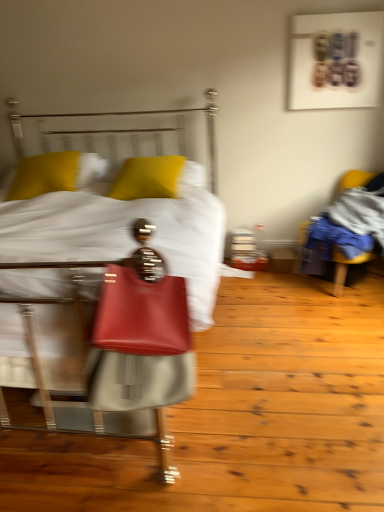
Describe the element at coordinates (140, 334) in the screenshot. I see `matte red handbag at center` at that location.

From the picture: What is the approximate width of yellow fabric chair at right?

It is 27.40 inches.

What do you see at coordinates (147, 178) in the screenshot?
I see `yellow matte pillow at center, the first pillow positioned from the right` at bounding box center [147, 178].

What do you see at coordinates (55, 173) in the screenshot? I see `yellow matte pillow at upper left, which appears as the 2th pillow when viewed from the right` at bounding box center [55, 173].

Locate an element on the screen. The height and width of the screenshot is (512, 384). matte red handbag at center is located at coordinates tap(140, 334).

Considering the relative sizes of yellow fabric chair at right and matte red handbag at center in the image provided, is yellow fabric chair at right shorter than matte red handbag at center?

No.

Is point (355, 258) closer to camera compared to point (106, 300)?

No, it is not.

Where is `person positioned vertically above the yellow fabric chair at right (from a real-world perspective)`? person positioned vertically above the yellow fabric chair at right (from a real-world perspective) is located at coordinates (140, 334).

Considering the sizes of objects yellow fabric chair at right and matte red handbag at center in the image provided, who is wider, yellow fabric chair at right or matte red handbag at center?

Wider between the two is yellow fabric chair at right.

Is yellow matte pillow at upper left, which appears as the 2th pillow when viewed from the right, aimed at yellow matte pillow at center, the first pillow positioned from the right?

No, yellow matte pillow at upper left, which appears as the 2th pillow when viewed from the right, does not turn towards yellow matte pillow at center, the first pillow positioned from the right.

Which object is closer to the camera, yellow matte pillow at upper left, which appears as the 2th pillow when viewed from the right, or yellow matte pillow at center, the second pillow in the left-to-right sequence?

Positioned in front is yellow matte pillow at center, the second pillow in the left-to-right sequence.

In the scene shown: Considering the sizes of yellow matte pillow at upper left, which appears as the 2th pillow when viewed from the right, and yellow matte pillow at center, the second pillow in the left-to-right sequence, in the image, is yellow matte pillow at upper left, which appears as the 2th pillow when viewed from the right, wider or thinner than yellow matte pillow at center, the second pillow in the left-to-right sequence,?

yellow matte pillow at upper left, which appears as the 2th pillow when viewed from the right, is thinner than yellow matte pillow at center, the second pillow in the left-to-right sequence.

Looking at this image, does yellow matte pillow at center, the first pillow positioned from the right, turn towards yellow fabric chair at right?

No, yellow matte pillow at center, the first pillow positioned from the right, is not oriented towards yellow fabric chair at right.

Is point (149, 189) closer to camera compared to point (295, 261)?

Yes, it is.

Based on their sizes in the image, would you say yellow matte pillow at center, the second pillow in the left-to-right sequence, is bigger or smaller than yellow fabric chair at right?

yellow matte pillow at center, the second pillow in the left-to-right sequence, is smaller than yellow fabric chair at right.

Locate an element on the screen. This screenshot has width=384, height=512. chair that appears on the right of yellow matte pillow at center, the first pillow positioned from the right is located at coordinates (344, 269).

Which is behind, point (167, 211) or point (153, 165)?

The point (153, 165) is behind.

From the image's perspective, relative to yellow matte pillow at center, the first pillow positioned from the right, is matte leather bed at center above or below?

matte leather bed at center is below yellow matte pillow at center, the first pillow positioned from the right.

Which of these two, matte leather bed at center or yellow matte pillow at center, the second pillow in the left-to-right sequence, stands taller?

Answer: matte leather bed at center is taller.

Would you say yellow matte pillow at upper left, which appears as the 2th pillow when viewed from the right, is to the left or to the right of matte red handbag at center in the picture?

yellow matte pillow at upper left, which appears as the 2th pillow when viewed from the right, is positioned on matte red handbag at center's left side.

Is yellow matte pillow at upper left, marked as the 1th pillow in a left-to-right arrangement, positioned before matte red handbag at center?

No.

From their relative heights in the image, would you say yellow matte pillow at upper left, which appears as the 2th pillow when viewed from the right, is taller or shorter than matte red handbag at center?

Clearly, yellow matte pillow at upper left, which appears as the 2th pillow when viewed from the right, is shorter compared to matte red handbag at center.

Does yellow matte pillow at upper left, marked as the 1th pillow in a left-to-right arrangement, have a larger size compared to matte red handbag at center?

Correct, yellow matte pillow at upper left, marked as the 1th pillow in a left-to-right arrangement, is larger in size than matte red handbag at center.

Where is `bed that is on the right side of yellow matte pillow at upper left, which appears as the 2th pillow when viewed from the right`? The width and height of the screenshot is (384, 512). bed that is on the right side of yellow matte pillow at upper left, which appears as the 2th pillow when viewed from the right is located at coordinates (107, 287).

In the scene shown: Can you confirm if yellow matte pillow at upper left, which appears as the 2th pillow when viewed from the right, is thinner than matte leather bed at center?

Yes.

Is yellow matte pillow at upper left, marked as the 1th pillow in a left-to-right arrangement, turned away from matte leather bed at center?

That's right, yellow matte pillow at upper left, marked as the 1th pillow in a left-to-right arrangement, is facing away from matte leather bed at center.

Measure the distance from yellow matte pillow at center, the first pillow positioned from the right, to matte red handbag at center.

They are 1.36 meters apart.

Considering the sizes of yellow matte pillow at center, the first pillow positioned from the right, and matte red handbag at center in the image, is yellow matte pillow at center, the first pillow positioned from the right, taller or shorter than matte red handbag at center?

Considering their sizes, yellow matte pillow at center, the first pillow positioned from the right, has less height than matte red handbag at center.

Looking at this image, from a real-world perspective, relative to matte red handbag at center, is yellow matte pillow at center, the first pillow positioned from the right, vertically above or below?

From a real-world perspective, yellow matte pillow at center, the first pillow positioned from the right, is physically above matte red handbag at center.

Looking at this image, is yellow matte pillow at center, the first pillow positioned from the right, spatially inside matte red handbag at center, or outside of it?

yellow matte pillow at center, the first pillow positioned from the right, lies outside matte red handbag at center.

Locate an element on the screen. This screenshot has height=512, width=384. person lying on the left of yellow fabric chair at right is located at coordinates (140, 334).

I want to click on pillow below the yellow matte pillow at center, the second pillow in the left-to-right sequence (from a real-world perspective), so click(55, 173).

Looking at the image, which one is located closer to matte red handbag at center, yellow matte pillow at upper left, marked as the 1th pillow in a left-to-right arrangement, or matte leather bed at center?

The object closer to matte red handbag at center is matte leather bed at center.

When comparing their distances from yellow fabric chair at right, does matte red handbag at center or yellow matte pillow at center, the first pillow positioned from the right, seem closer?

yellow matte pillow at center, the first pillow positioned from the right, lies closer to yellow fabric chair at right than the other object.

From the image, which object appears to be farther from yellow matte pillow at center, the first pillow positioned from the right, matte leather bed at center or yellow matte pillow at upper left, marked as the 1th pillow in a left-to-right arrangement?

Among the two, matte leather bed at center is located further to yellow matte pillow at center, the first pillow positioned from the right.

From the image, which object appears to be farther from matte leather bed at center, matte red handbag at center or yellow fabric chair at right?

yellow fabric chair at right lies further to matte leather bed at center than the other object.

Looking at the image, which one is located further to matte leather bed at center, yellow matte pillow at center, the first pillow positioned from the right, or matte red handbag at center?

Based on the image, yellow matte pillow at center, the first pillow positioned from the right, appears to be further to matte leather bed at center.

Considering their positions, is yellow fabric chair at right positioned closer to yellow matte pillow at center, the second pillow in the left-to-right sequence, than matte leather bed at center?

Based on the image, matte leather bed at center appears to be nearer to yellow matte pillow at center, the second pillow in the left-to-right sequence.

Looking at the image, which one is located further to yellow fabric chair at right, matte red handbag at center or matte leather bed at center?

matte red handbag at center.

Looking at the image, which one is located further to matte red handbag at center, yellow fabric chair at right or matte leather bed at center?

yellow fabric chair at right is further to matte red handbag at center.

Find the location of `person located between yellow matte pillow at upper left, which appears as the 2th pillow when viewed from the right, and yellow fabric chair at right in the left-right direction`. person located between yellow matte pillow at upper left, which appears as the 2th pillow when viewed from the right, and yellow fabric chair at right in the left-right direction is located at coordinates [x=140, y=334].

The width and height of the screenshot is (384, 512). In order to click on pillow between matte leather bed at center and yellow matte pillow at upper left, which appears as the 2th pillow when viewed from the right, from front to back in this screenshot , I will do `click(147, 178)`.

You are a GUI agent. You are given a task and a screenshot of the screen. Output one action in this format:
    pyautogui.click(x=<x>, y=<y>)
    Task: Click on the bed between yellow matte pillow at upper left, marked as the 1th pillow in a left-to-right arrangement, and yellow fabric chair at right from left to right
    This screenshot has width=384, height=512.
    Given the screenshot: What is the action you would take?
    pyautogui.click(x=107, y=287)

Identify the location of person between matte leather bed at center and yellow fabric chair at right in the horizontal direction. (140, 334).